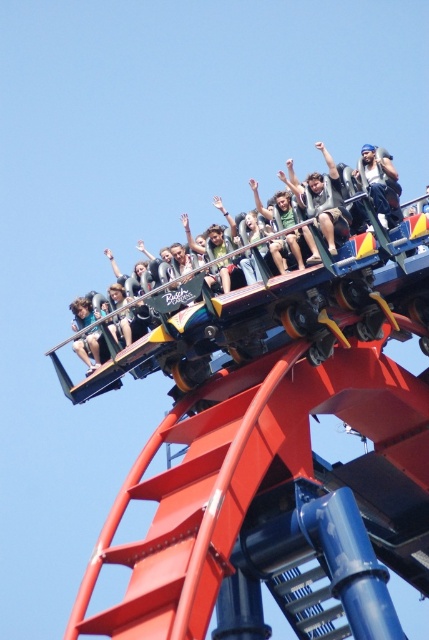
You are a photographer standing at the base of the roller coaster. You notice two people in the crowd watching the ride. One is wearing a beige fabric shirt at center, and the other has a denim jacket at upper center. Which person is closer to you?

The beige fabric shirt at center is positioned under the denim jacket at upper center, meaning the denim jacket at upper center is closer to you.

You are a photographer taking a picture of the roller coaster scene. You notice the beige fabric shirt at center and the denim jacket at upper center. Which clothing item will appear closer to the camera in the photo?

The beige fabric shirt at center will appear closer to the camera because it is in front of the denim jacket at upper center.